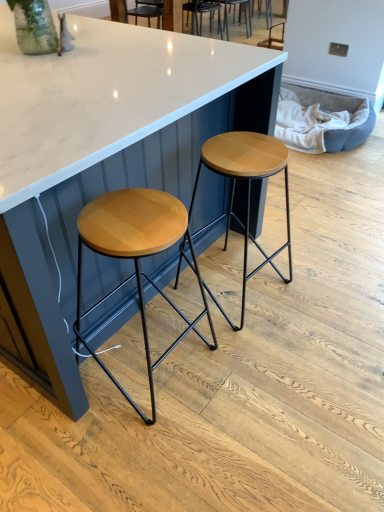
You are a GUI agent. You are given a task and a screenshot of the screen. Output one action in this format:
    pyautogui.click(x=<x>, y=<y>)
    Task: Click on the vacant area on top of woodenmaterial/texturestool at left, which appears as the 2th stool when viewed from the right (from a real-world perspective)
    The height and width of the screenshot is (512, 384).
    Given the screenshot: What is the action you would take?
    pyautogui.click(x=130, y=217)